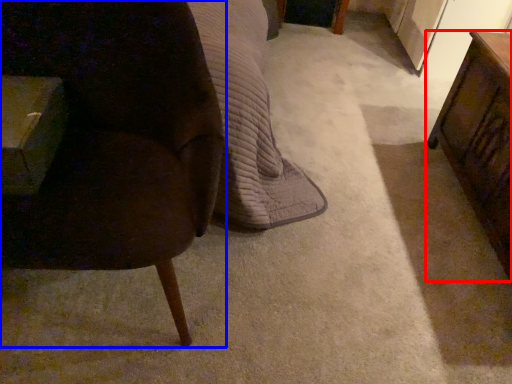
Question: Among these objects, which one is farthest to the camera, table (highlighted by a red box) or chair (highlighted by a blue box)?

Choices:
 (A) table
 (B) chair

Answer: (A)